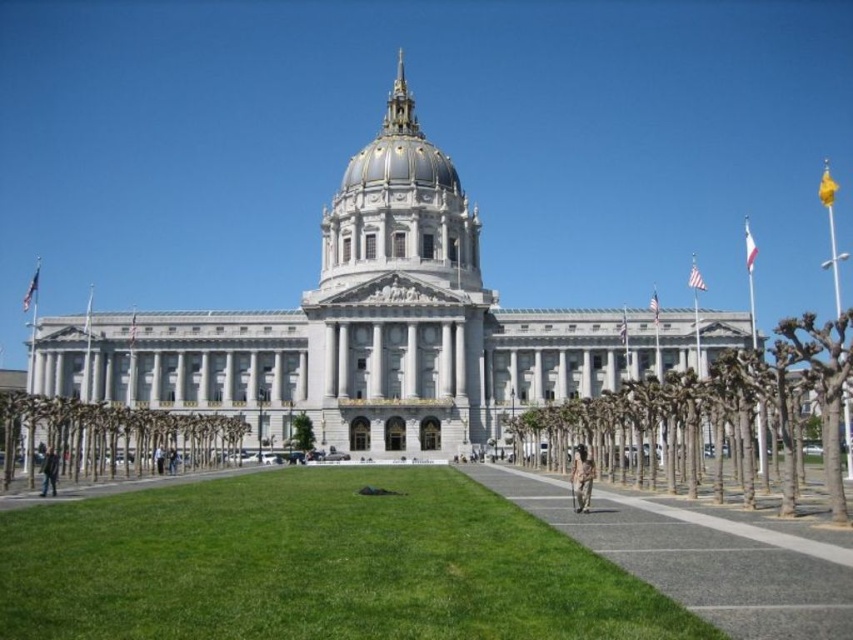
What do you see at coordinates (703, 556) in the screenshot?
I see `gray asphalt path at lower center` at bounding box center [703, 556].

Measure the distance between gray asphalt path at lower center and camera.

A distance of 24.84 meters exists between gray asphalt path at lower center and camera.

You are a GUI agent. You are given a task and a screenshot of the screen. Output one action in this format:
    pyautogui.click(x=<x>, y=<y>)
    Task: Click on the gray asphalt path at lower center
    The image size is (853, 640).
    Given the screenshot: What is the action you would take?
    pyautogui.click(x=703, y=556)

Can you confirm if gold metallic dome at center is positioned to the right of green leafy tree at center?

Correct, you'll find gold metallic dome at center to the right of green leafy tree at center.

Is gold metallic dome at center behind green leafy tree at center?

Yes, gold metallic dome at center is behind green leafy tree at center.

The height and width of the screenshot is (640, 853). What do you see at coordinates (399, 150) in the screenshot? I see `gold metallic dome at center` at bounding box center [399, 150].

Where is `gold metallic dome at center`? The image size is (853, 640). gold metallic dome at center is located at coordinates (399, 150).

Who is lower down, bare branches at center or gold metallic dome at center?

bare branches at center

Is point (764, 396) closer to camera compared to point (352, 177)?

Yes.

Locate an element on the screen. The width and height of the screenshot is (853, 640). bare branches at center is located at coordinates (715, 416).